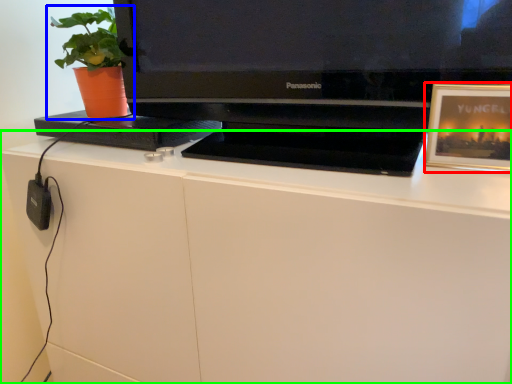
Question: Considering the real-world distances, which object is closest to picture frame (highlighted by a red box)? houseplant (highlighted by a blue box) or desk (highlighted by a green box).

Choices:
 (A) houseplant
 (B) desk

Answer: (B)